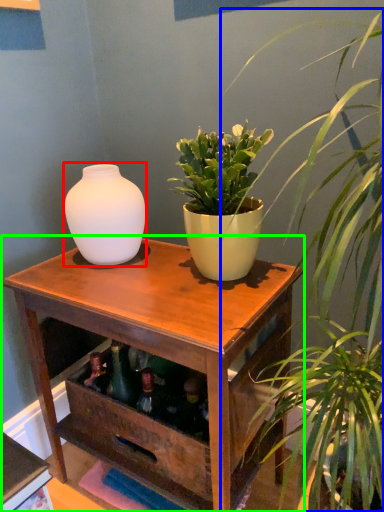
Question: Which object is positioned farthest from vase (highlighted by a red box)? Select from houseplant (highlighted by a blue box) and table (highlighted by a green box).

Choices:
 (A) houseplant
 (B) table

Answer: (A)